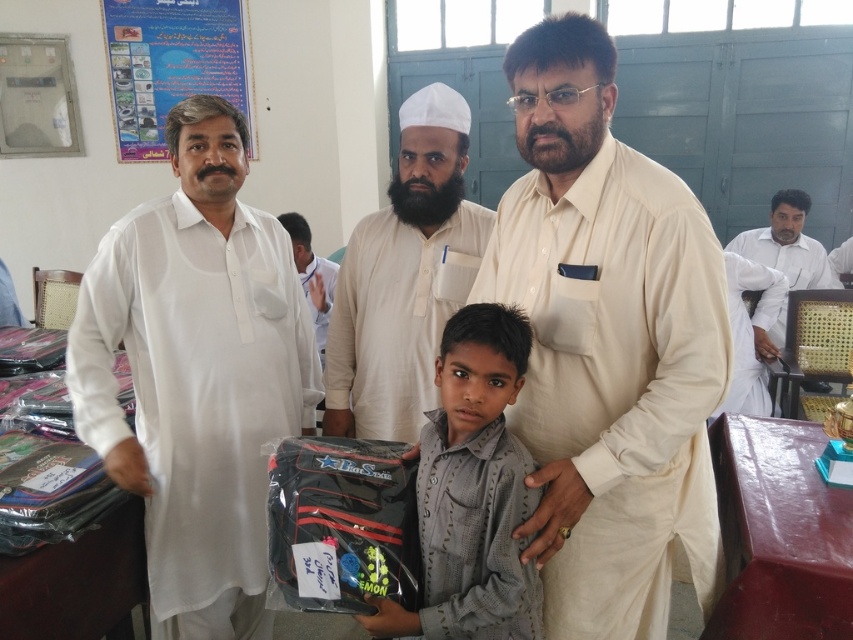
This screenshot has height=640, width=853. What do you see at coordinates (607, 344) in the screenshot?
I see `light beige cotton shirt at center` at bounding box center [607, 344].

Can you confirm if light beige cotton shirt at center is wider than white cotton chair at right?

Incorrect, light beige cotton shirt at center's width does not surpass white cotton chair at right's.

Is point (717, 248) farther from camera compared to point (787, 262)?

No, (717, 248) is closer to viewer.

The width and height of the screenshot is (853, 640). I want to click on light beige cotton shirt at center, so click(607, 344).

Who is more forward, (389, 330) or (137, 132)?

Point (389, 330)

Where is `white cotton shirt at center`? This screenshot has height=640, width=853. white cotton shirt at center is located at coordinates (402, 276).

Between point (100, 268) and point (335, 324), which one is positioned behind?

Point (335, 324)

Identify the location of white cotton shirt at left. (196, 374).

Consider the image. Who is more distant from viewer, [262,289] or [463,221]?

Positioned behind is point [463,221].

Locate an element on the screen. The height and width of the screenshot is (640, 853). white cotton shirt at left is located at coordinates (196, 374).